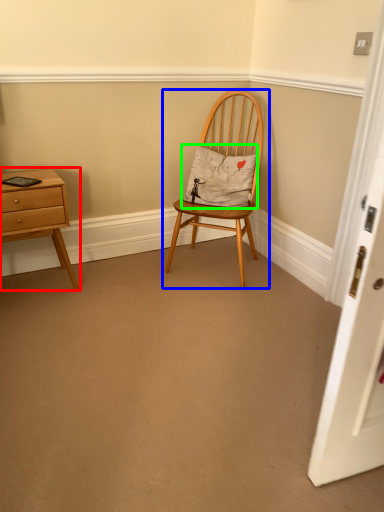
Question: Which is nearer to the nightstand (highlighted by a red box)? chair (highlighted by a blue box) or pillow (highlighted by a green box).

Choices:
 (A) chair
 (B) pillow

Answer: (A)